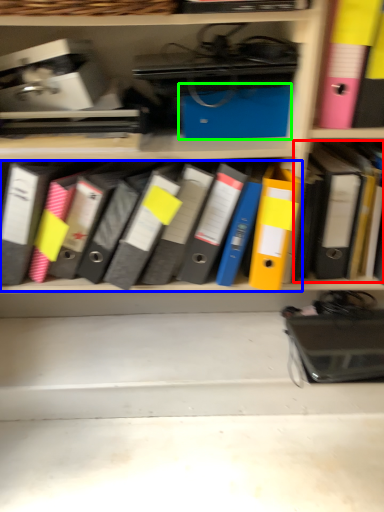
Question: Considering the real-world distances, which object is farthest from book (highlighted by a red box)? notebook (highlighted by a blue box) or paperback book (highlighted by a green box)?

Choices:
 (A) notebook
 (B) paperback book

Answer: (A)